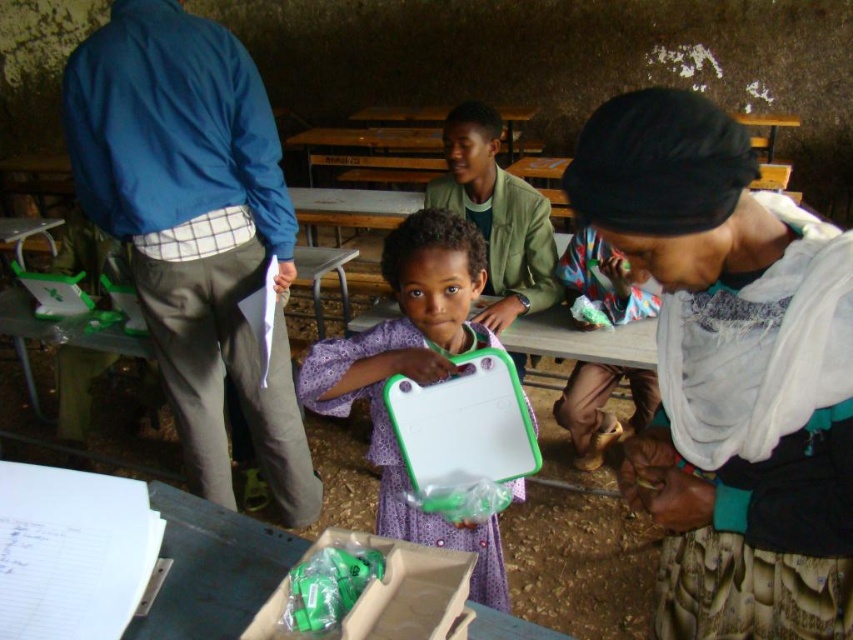
Question: Does blue fabric jacket at upper left have a lesser width compared to purple fabric dress at center?

Choices:
 (A) no
 (B) yes

Answer: (A)

Question: Which point is closer to the camera?

Choices:
 (A) (569, 637)
 (B) (770, 588)
 (C) (328, 400)

Answer: (B)

Question: Is blue fabric jacket at upper left wider than multicolored fabric at lower right?

Choices:
 (A) yes
 (B) no

Answer: (A)

Question: Which object is the closest to the green plastic tray at center?

Choices:
 (A) white cloth headscarf at upper right
 (B) blue fabric jacket at upper left
 (C) multicolored fabric at lower right
 (D) purple fabric dress at center

Answer: (D)

Question: Which object is the farthest from the multicolored fabric at lower right?

Choices:
 (A) blue fabric jacket at upper left
 (B) white cloth headscarf at upper right
 (C) purple fabric dress at center
 (D) green plastic tray at center

Answer: (D)

Question: Can you confirm if blue fabric jacket at upper left is positioned to the left of multicolored fabric at lower right?

Choices:
 (A) yes
 (B) no

Answer: (A)